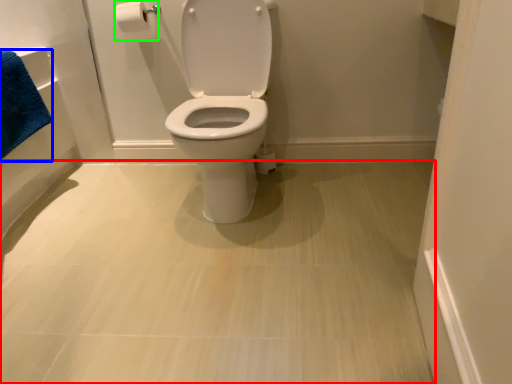
Question: Considering the real-world distances, which object is farthest from plain (highlighted by a red box)? bath towel (highlighted by a blue box) or toilet paper (highlighted by a green box)?

Choices:
 (A) bath towel
 (B) toilet paper

Answer: (B)